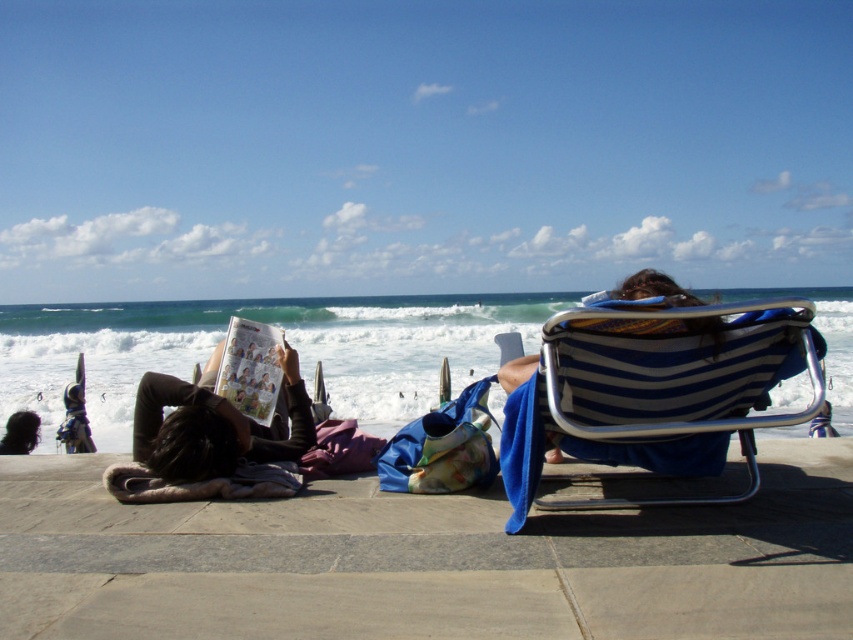
You are standing at the camera position looking at the beach scene. There are two points marked in the image. Which point, point (730, 522) or point (225, 369), is closer to you?

Point (730, 522) is closer to the camera than point (225, 369).

You are standing at the center of the beach scene and want to move towards the blue striped fabric beach chair at right. Based on the coordinates provided in the description, is the chair positioned more to the right or left side of the image?

The blue striped fabric beach chair at right is located at point 0.594 on the x and 0.783 on the y, so the chair is positioned more to the right side of the image.